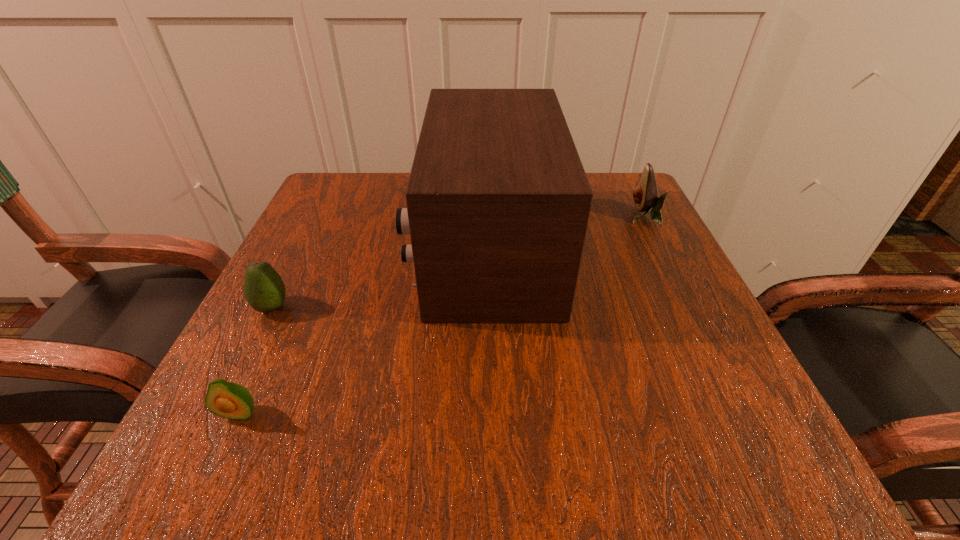
The width and height of the screenshot is (960, 540). I want to click on vacant area at the near edge, so click(638, 441).

Identify the location of blank area at the left edge. (235, 379).

In the image, there is a desktop. Where is `vacant space at the right edge`? The image size is (960, 540). vacant space at the right edge is located at coordinates (673, 386).

Where is `vacant point at the far left corner`? The height and width of the screenshot is (540, 960). vacant point at the far left corner is located at coordinates coord(350,218).

This screenshot has width=960, height=540. I want to click on free space at the near left corner of the desktop, so click(208, 438).

The height and width of the screenshot is (540, 960). Find the location of `free space at the far right corner of the desktop`. free space at the far right corner of the desktop is located at coordinates (600, 179).

I want to click on free space between the radio receiver and the nearest object, so pos(363,331).

At what (x,y) coordinates should I click in order to perform the action: click on unoccupied area between the second nearest avocado and the nearest avocado. Please return your answer as a coordinate pair (x, y). The image size is (960, 540). Looking at the image, I should click on coord(255,360).

Find the location of `free space between the second nearest avocado and the second object from right to left`. free space between the second nearest avocado and the second object from right to left is located at coordinates (379, 278).

This screenshot has width=960, height=540. In order to click on vacant area that lies between the second farthest avocado and the nearest object in this screenshot , I will do `click(255, 360)`.